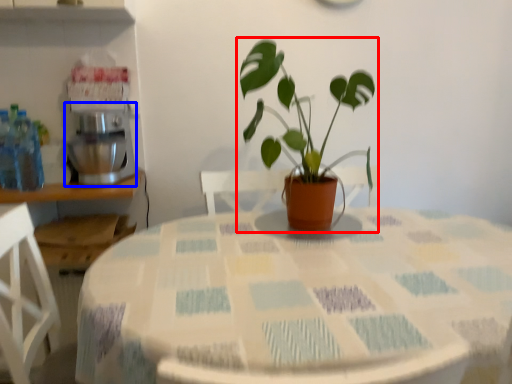
Question: Which point is closer to the camera, houseplant (highlighted by a red box) or mixer (highlighted by a blue box)?

Choices:
 (A) houseplant
 (B) mixer

Answer: (A)